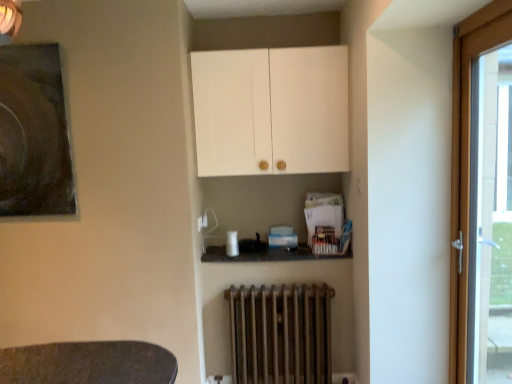
Question: From a real-world perspective, is rusty metal radiator at lower center over dark matte painting at upper left?

Choices:
 (A) no
 (B) yes

Answer: (A)

Question: Is rusty metal radiator at lower center not close to dark matte painting at upper left?

Choices:
 (A) no
 (B) yes

Answer: (B)

Question: Considering the relative positions of rusty metal radiator at lower center and dark matte painting at upper left in the image provided, is rusty metal radiator at lower center to the left of dark matte painting at upper left from the viewer's perspective?

Choices:
 (A) yes
 (B) no

Answer: (B)

Question: Is rusty metal radiator at lower center bigger than dark matte painting at upper left?

Choices:
 (A) yes
 (B) no

Answer: (A)

Question: Could you tell me if rusty metal radiator at lower center is turned towards dark matte painting at upper left?

Choices:
 (A) yes
 (B) no

Answer: (B)

Question: Is rusty metal radiator at lower center not inside dark matte painting at upper left?

Choices:
 (A) yes
 (B) no

Answer: (A)

Question: Can you confirm if rusty metal radiator at lower center is smaller than wooden door at right?

Choices:
 (A) no
 (B) yes

Answer: (B)

Question: Considering the relative sizes of rusty metal radiator at lower center and wooden door at right in the image provided, is rusty metal radiator at lower center taller than wooden door at right?

Choices:
 (A) no
 (B) yes

Answer: (A)

Question: From the image's perspective, would you say rusty metal radiator at lower center is positioned over wooden door at right?

Choices:
 (A) yes
 (B) no

Answer: (B)

Question: From a real-world perspective, is rusty metal radiator at lower center on top of wooden door at right?

Choices:
 (A) yes
 (B) no

Answer: (B)

Question: Does rusty metal radiator at lower center lie in front of wooden door at right?

Choices:
 (A) yes
 (B) no

Answer: (B)

Question: Is rusty metal radiator at lower center shorter than wooden door at right?

Choices:
 (A) no
 (B) yes

Answer: (B)

Question: Is white matte cabinet at upper center closer to camera compared to wooden door at right?

Choices:
 (A) no
 (B) yes

Answer: (A)